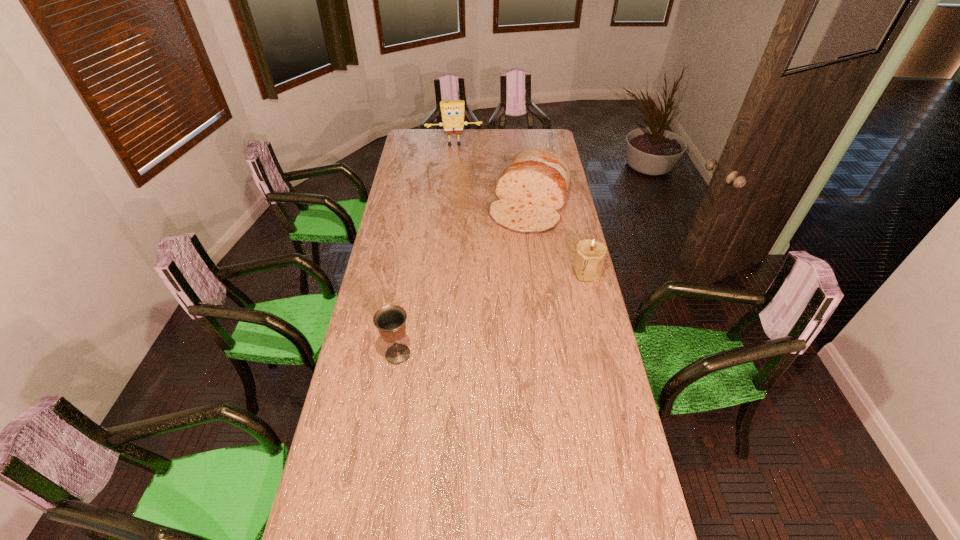
At what (x,y) coordinates should I click in order to perform the action: click on free space between the bread and the tallest object. Please return your answer as a coordinate pair (x, y). Image resolution: width=960 pixels, height=540 pixels. Looking at the image, I should click on (492, 176).

You are a GUI agent. You are given a task and a screenshot of the screen. Output one action in this format:
    pyautogui.click(x=<x>, y=<y>)
    Task: Click on the closest object relative to the third farthest object
    The height and width of the screenshot is (540, 960).
    Given the screenshot: What is the action you would take?
    pyautogui.click(x=532, y=188)

Choose which object is the nearest neighbor to the third nearest object. Please provide its 2D coordinates. Your answer should be formatted as a tuple, i.e. [(x, y)], where the tuple contains the x and y coordinates of a point satisfying the conditions above.

[(590, 254)]